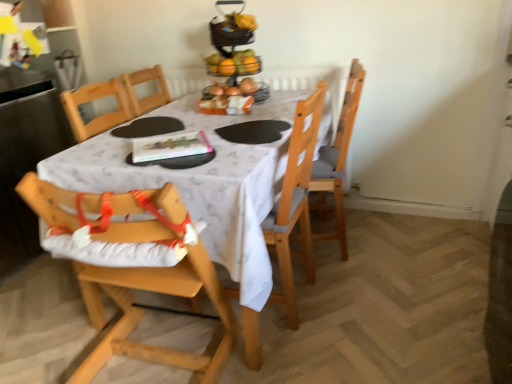
Where is `vacant space that is to the left of orange plastic basket at center`? vacant space that is to the left of orange plastic basket at center is located at coordinates (186, 110).